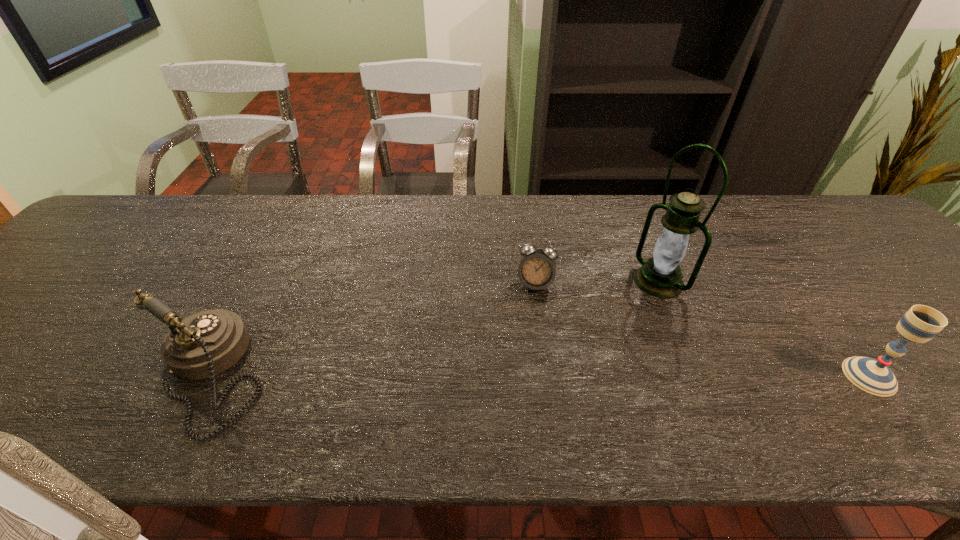
The height and width of the screenshot is (540, 960). Identify the location of vacant area at the far left corner. (170, 197).

The height and width of the screenshot is (540, 960). What are the coordinates of `vacant space at the far right corner of the desktop` in the screenshot? It's located at (852, 215).

Find the location of `unoccupied position between the alarm clock and the chalice`. unoccupied position between the alarm clock and the chalice is located at coordinates (703, 330).

Identify the location of vacant space that's between the third object from right to left and the leftmost object. (372, 329).

You are a GUI agent. You are given a task and a screenshot of the screen. Output one action in this format:
    pyautogui.click(x=<x>, y=<y>)
    Task: Click on the vacant space that is in between the third object from right to left and the lantern
    The height and width of the screenshot is (540, 960).
    Given the screenshot: What is the action you would take?
    coord(597,282)

Identify the location of vacant region between the telephone and the third object from left to right. Image resolution: width=960 pixels, height=540 pixels. (433, 328).

Find the location of a particular element. The image size is (960, 540). free space between the leftmost object and the lantern is located at coordinates (433, 328).

This screenshot has height=540, width=960. I want to click on unoccupied area between the rightmost object and the shortest object, so click(x=703, y=330).

Identify the location of unoccupied position between the second object from right to left and the third object from right to left. The image size is (960, 540). (597, 282).

In order to click on free point between the rightmost object and the lantern in this screenshot , I will do `click(764, 328)`.